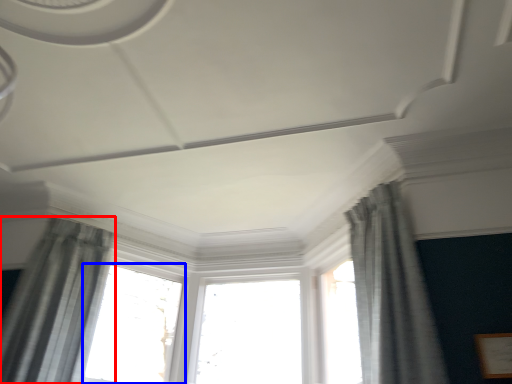
Question: Which object is closer to the camera taking this photo, curtain (highlighted by a red box) or window (highlighted by a blue box)?

Choices:
 (A) curtain
 (B) window

Answer: (A)